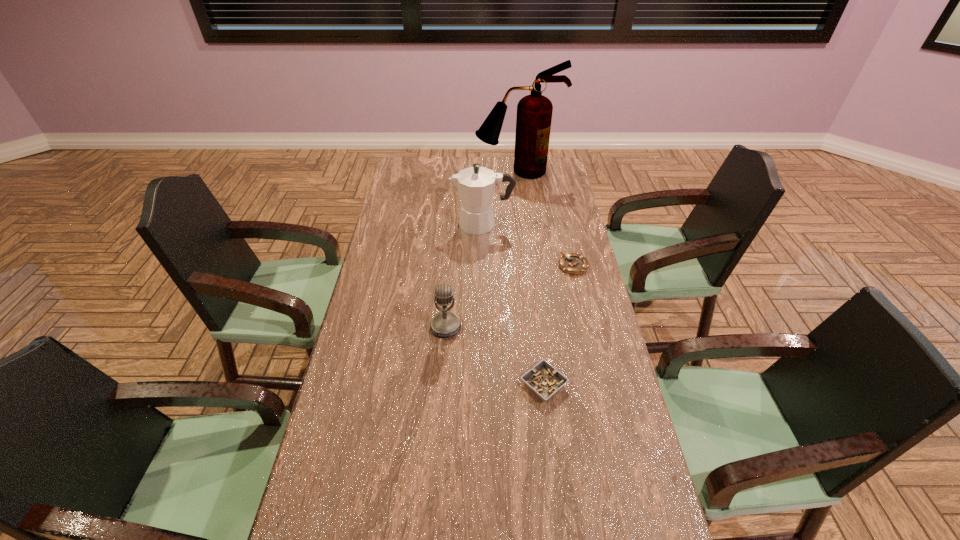
I want to click on vacant space at the far edge of the desktop, so click(x=502, y=160).

Locate an element on the screen. vacant area at the left edge is located at coordinates (403, 210).

The height and width of the screenshot is (540, 960). Find the location of `blank space at the right edge of the desktop`. blank space at the right edge of the desktop is located at coordinates (616, 361).

Locate an element on the screen. This screenshot has height=540, width=960. free space at the far left corner is located at coordinates (399, 179).

The image size is (960, 540). I want to click on free space at the far right corner of the desktop, so click(557, 165).

Locate an element on the screen. vacant area between the nearer ashtray and the fourth farthest object is located at coordinates (495, 356).

The image size is (960, 540). I want to click on vacant area between the farther ashtray and the third tallest object, so click(x=510, y=296).

You are a GUI agent. You are given a task and a screenshot of the screen. Output one action in this format:
    pyautogui.click(x=<x>, y=<y>)
    Task: Click on the free space that is in between the fourth shortest object and the left ashtray
    This screenshot has height=540, width=960.
    Given the screenshot: What is the action you would take?
    pyautogui.click(x=514, y=305)

This screenshot has height=540, width=960. Find the location of `free area in between the farthest object and the right ashtray`. free area in between the farthest object and the right ashtray is located at coordinates (545, 219).

The image size is (960, 540). Find the location of `free spot between the third shortest object and the fire extinguisher`. free spot between the third shortest object and the fire extinguisher is located at coordinates (482, 249).